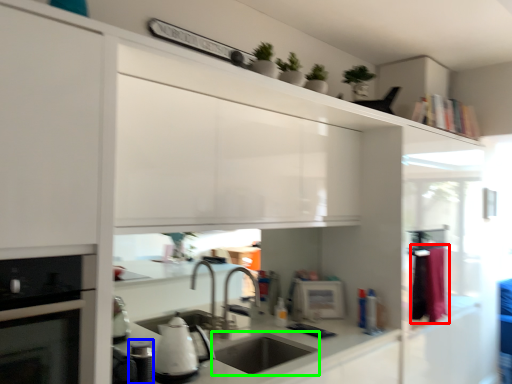
Question: Which object is the farthest from laundry (highlighted by a red box)? Choose among these: appliance (highlighted by a blue box) or sink (highlighted by a green box).

Choices:
 (A) appliance
 (B) sink

Answer: (A)